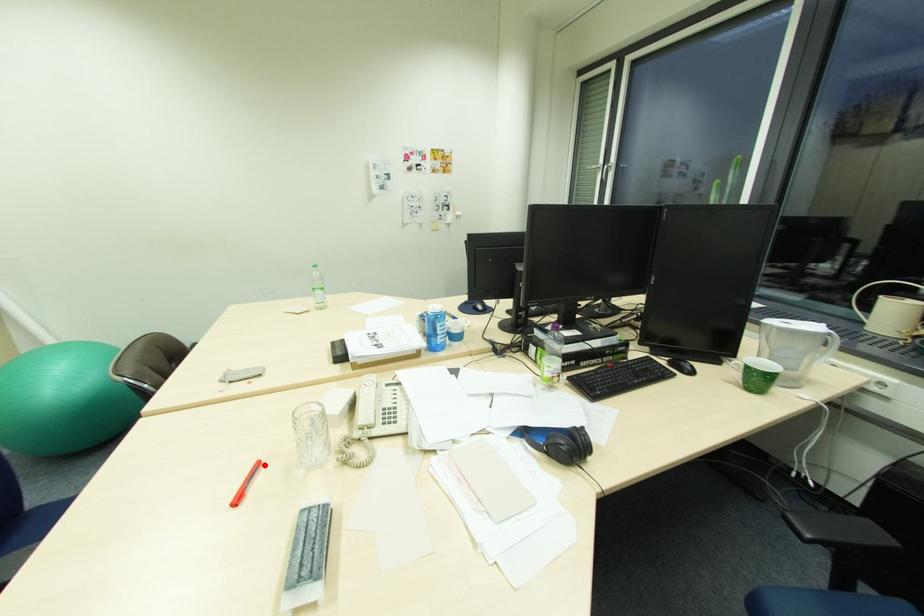
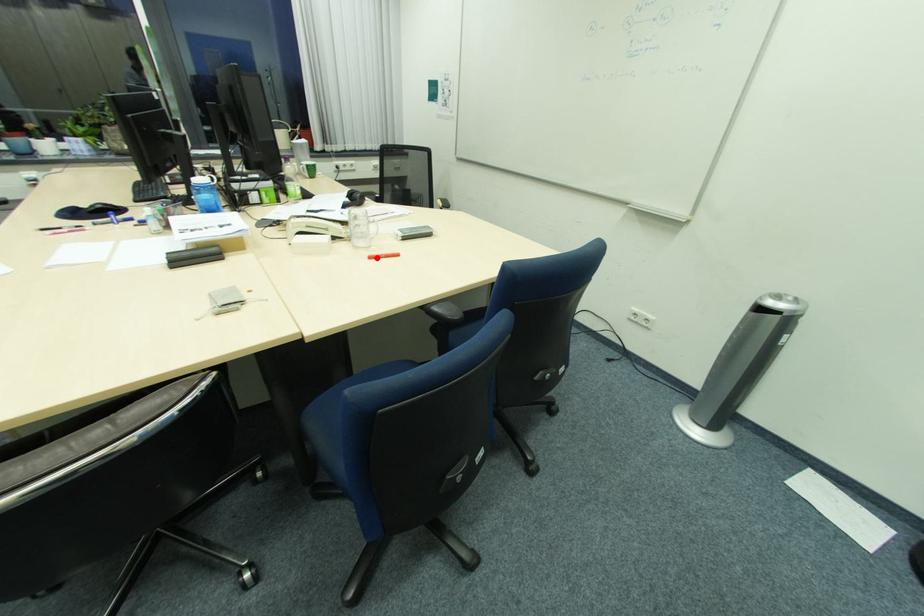
I am providing you with two images of the same scene from different viewpoints. A red point is marked on the first image and another point is marked on the second image. Does the point marked in image1 correspond to the same location as the one in image2?

Yes